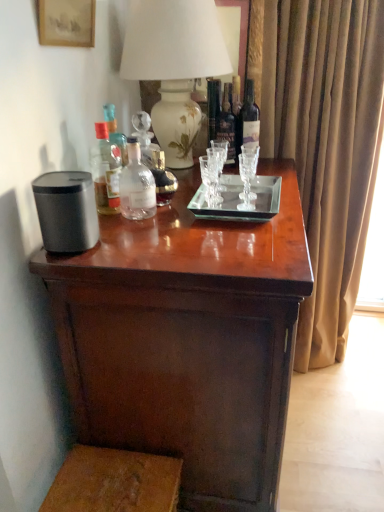
Identify the location of vacant region to the right of clear glass bottle at center, arranged as the 2th bottle when viewed from the left. The width and height of the screenshot is (384, 512). (196, 216).